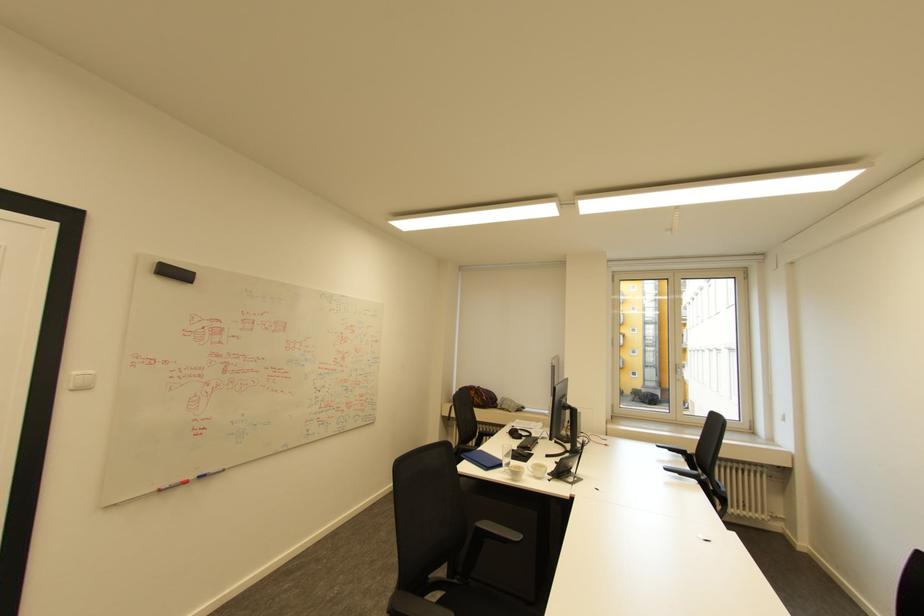
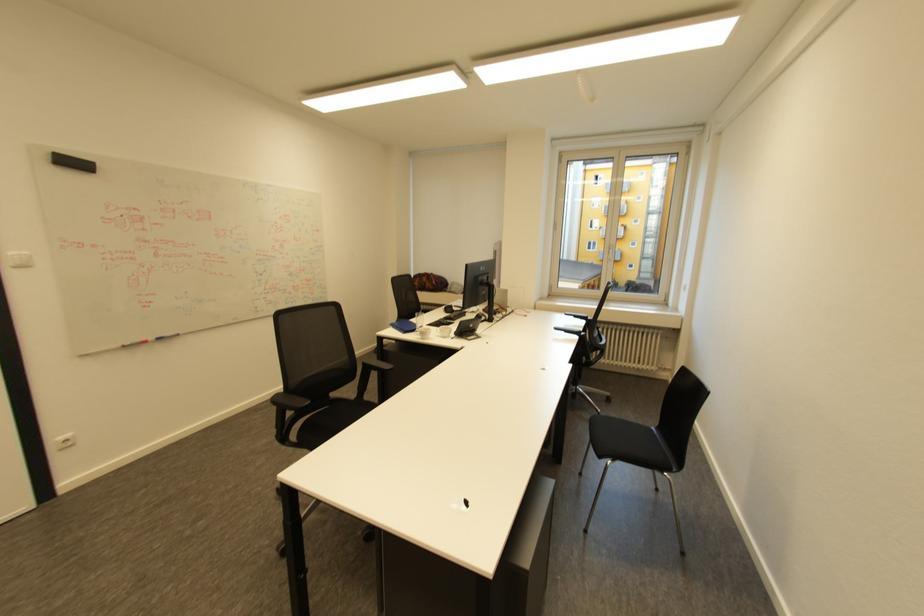
The point at (493, 468) is marked in the first image. Where is the corresponding point in the second image?

(411, 331)